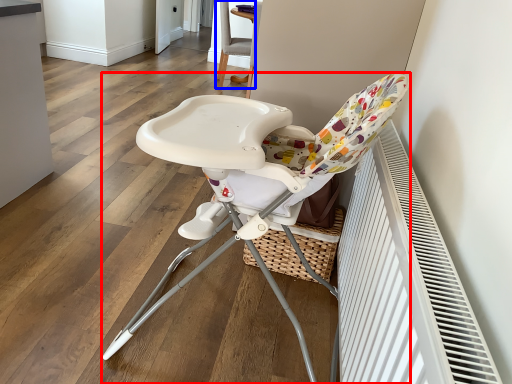
Question: Which object is further to the camera taking this photo, chair (highlighted by a red box) or chair (highlighted by a blue box)?

Choices:
 (A) chair
 (B) chair

Answer: (B)